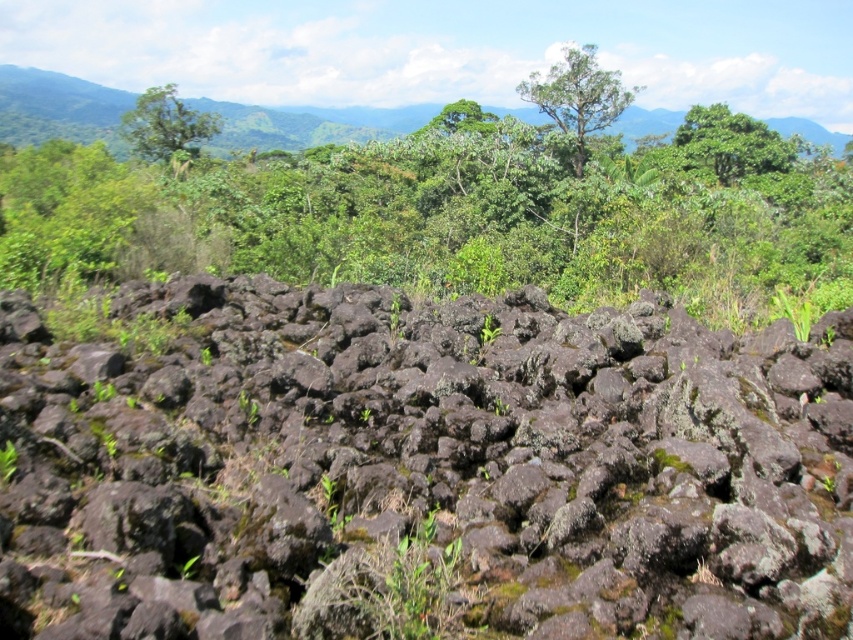
Is dark gray rough rock at center taller than green leafy tree at upper center?

No, dark gray rough rock at center is not taller than green leafy tree at upper center.

Does dark gray rough rock at center appear over green leafy tree at upper center?

Actually, dark gray rough rock at center is below green leafy tree at upper center.

Measure the distance between point (817, 342) and camera.

Point (817, 342) is 26.26 feet away from camera.

Find the location of a particular element. This screenshot has height=640, width=853. dark gray rough rock at center is located at coordinates (422, 470).

Is point (641, 429) farther from camera compared to point (135, 116)?

No.

What do you see at coordinates (422, 470) in the screenshot?
I see `dark gray rough rock at center` at bounding box center [422, 470].

Does point (749, 516) come behind point (173, 84)?

No, (749, 516) is closer to viewer.

The image size is (853, 640). Identify the location of dark gray rough rock at center. (422, 470).

Where is `dark gray rough rock at center`? dark gray rough rock at center is located at coordinates (422, 470).

Does dark gray rough rock at center appear on the left side of green leafy tree at upper right?

Correct, you'll find dark gray rough rock at center to the left of green leafy tree at upper right.

Image resolution: width=853 pixels, height=640 pixels. What are the coordinates of `dark gray rough rock at center` in the screenshot? It's located at (422, 470).

I want to click on dark gray rough rock at center, so click(x=422, y=470).